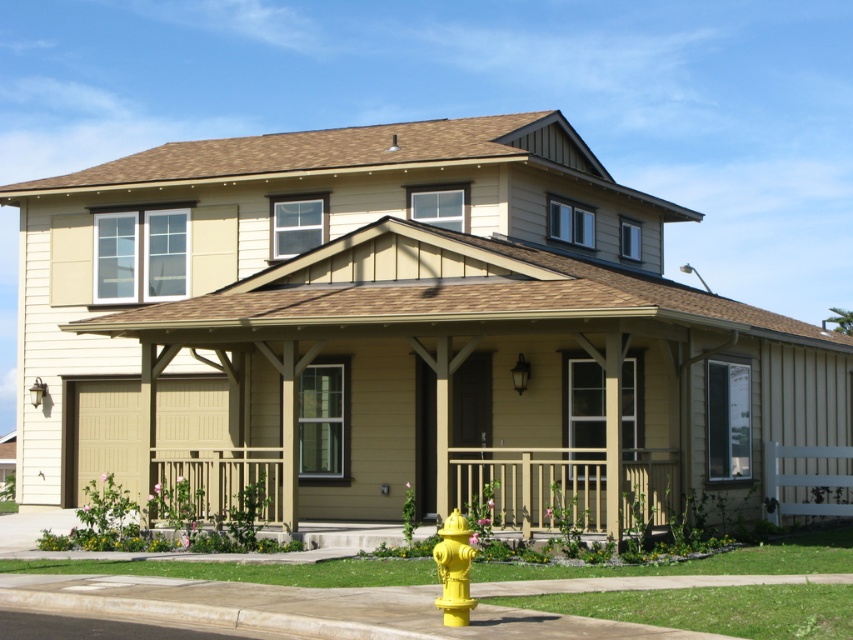
You are standing in front of the house and notice the wooden railing at center and the yellow matte hydrant at lower center. Which object is positioned to the right when facing the house?

The wooden railing at center is to the right of the yellow matte hydrant at lower center, so the wooden railing at center is positioned to the right when facing the house.

You are a delivery person approaching the house and need to place a package on the yellow plastic curb at lower center. The wooden railing at center is in your way. Can you move the package to the curb without going around the railing?

The yellow plastic curb at lower center is to the left of the wooden railing at center, so you can move the package to the curb by moving it to the left side of the railing.